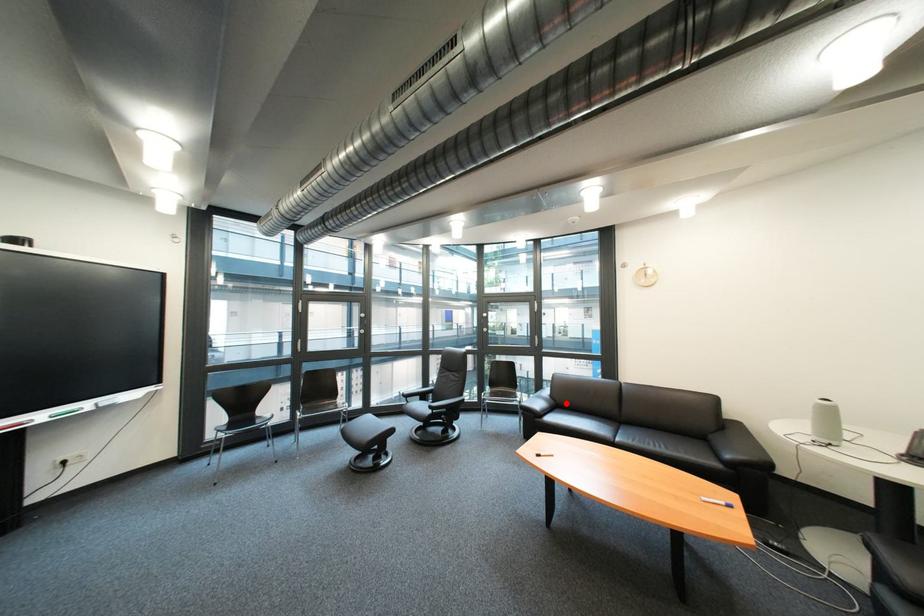
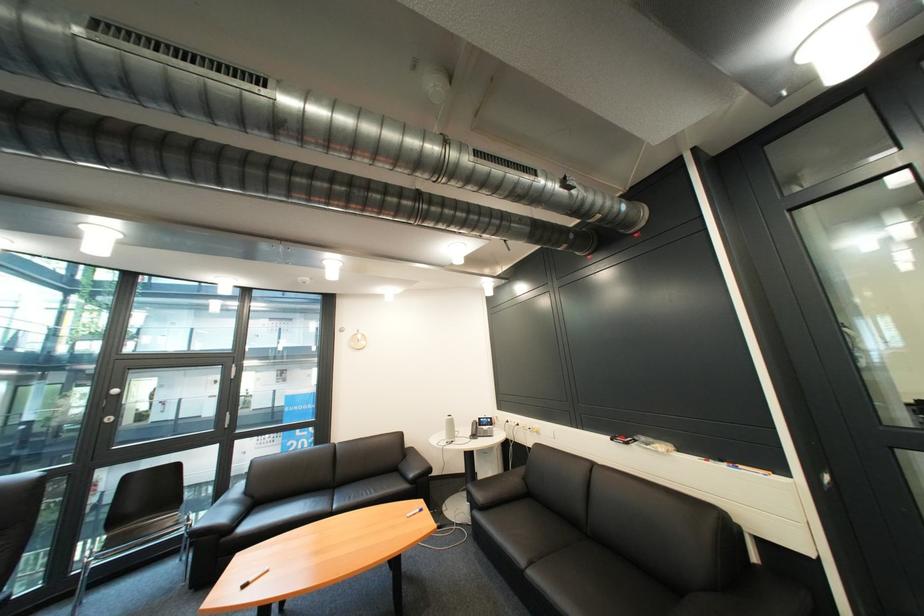
Question: I am providing you with two images of the same scene from different viewpoints. In image1, a red point is highlighted. Considering the same 3D point in image2, which of the following is correct?

Choices:
 (A) It is closer
 (B) It is farther

Answer: (B)